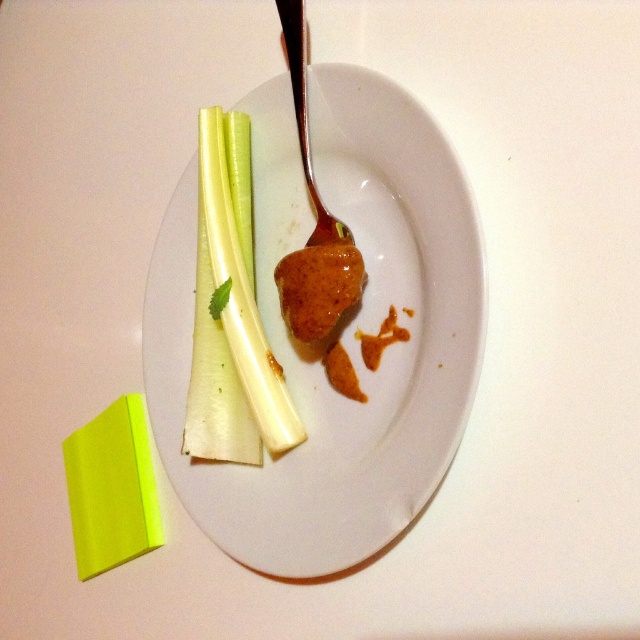
Question: Is neon yellow paper at lower left to the left of shiny silver fork at center from the viewer's perspective?

Choices:
 (A) no
 (B) yes

Answer: (B)

Question: Does white crisp celery at center lie in front of shiny silver fork at center?

Choices:
 (A) no
 (B) yes

Answer: (A)

Question: Which of the following is the closest to the observer?

Choices:
 (A) white glossy plate at center
 (B) white crisp celery at center

Answer: (A)

Question: Can you confirm if white glossy plate at center is positioned to the right of white crisp celery at center?

Choices:
 (A) yes
 (B) no

Answer: (A)

Question: Estimate the real-world distances between objects in this image. Which object is closer to the white crisp celery at center?

Choices:
 (A) shiny silver fork at center
 (B) white glossy plate at center

Answer: (B)

Question: Which point appears farthest from the camera in this image?

Choices:
 (A) (120, 525)
 (B) (202, 385)

Answer: (A)